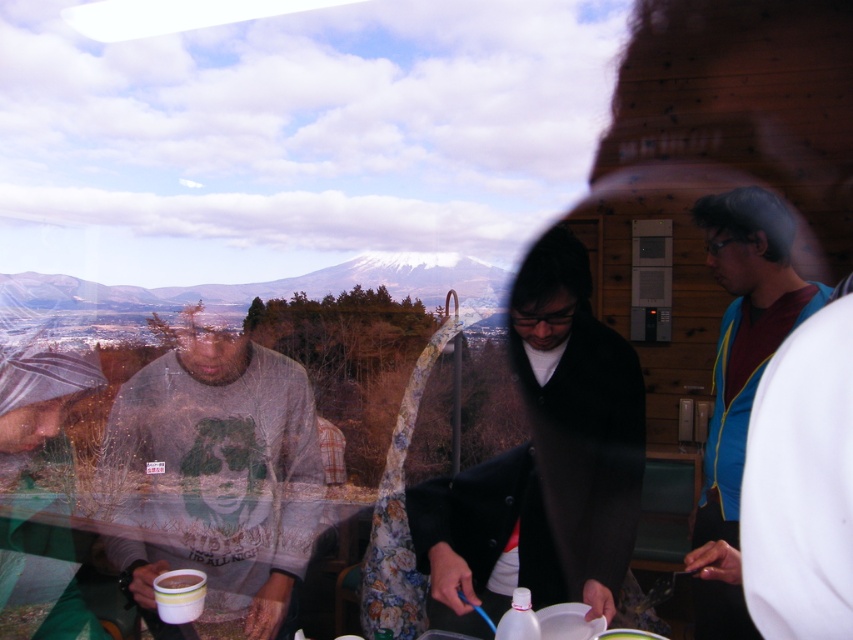
Question: Among these objects, which one is nearest to the camera?

Choices:
 (A) white snow-covered mountain at center
 (B) white paper cup at lower left

Answer: (B)

Question: Which object appears farthest from the camera in this image?

Choices:
 (A) white paper cup at lower left
 (B) white matte cup at lower left
 (C) matte gray shirt at left

Answer: (C)

Question: Is black matte coat at center positioned at the back of white paper cup at lower left?

Choices:
 (A) yes
 (B) no

Answer: (B)

Question: Which object is the farthest from the blue fabric shirt at right?

Choices:
 (A) white paper cup at lower left
 (B) matte gray shirt at left
 (C) white snow-covered mountain at center

Answer: (C)

Question: Is black matte coat at center above white matte cup at lower left?

Choices:
 (A) yes
 (B) no

Answer: (A)

Question: Considering the relative positions of white snow-covered mountain at center and white matte cup at lower left in the image provided, where is white snow-covered mountain at center located with respect to white matte cup at lower left?

Choices:
 (A) above
 (B) below

Answer: (A)